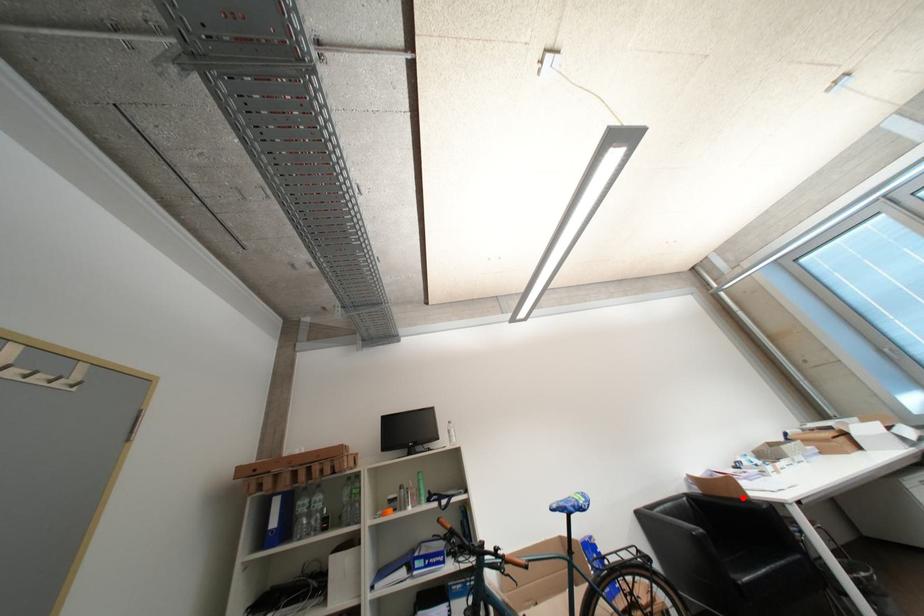
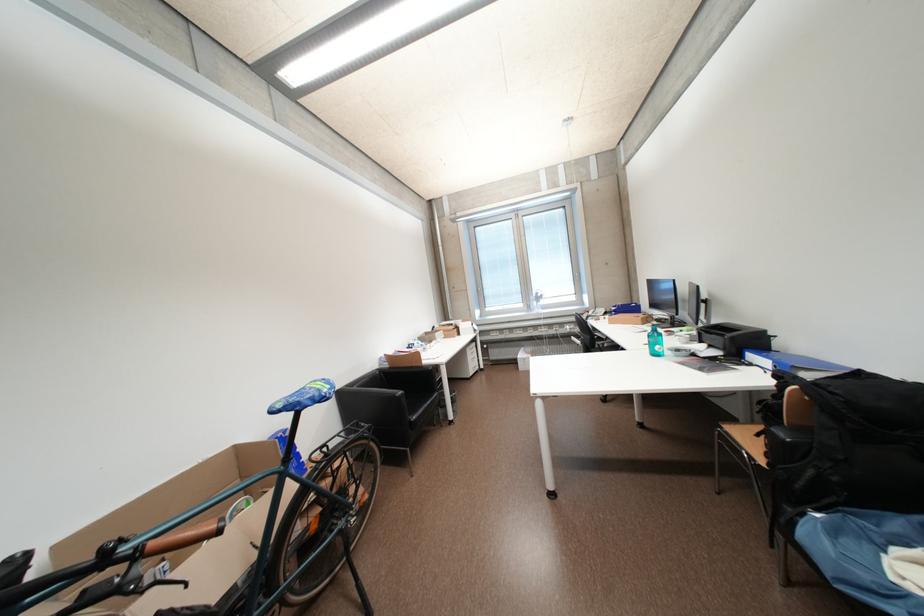
In the second image, find the point that corresponds to the highlighted location in the first image.

(421, 367)